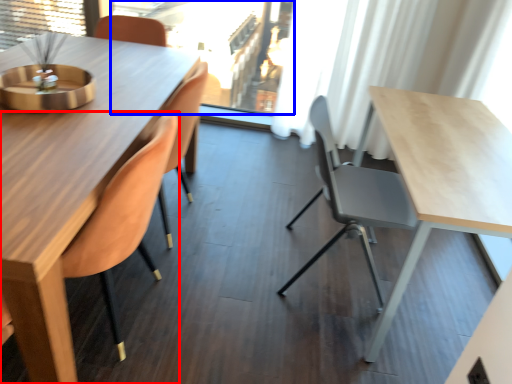
Question: Which of the following is the closest to the observer, chair (highlighted by a red box) or window screen (highlighted by a blue box)?

Choices:
 (A) chair
 (B) window screen

Answer: (A)